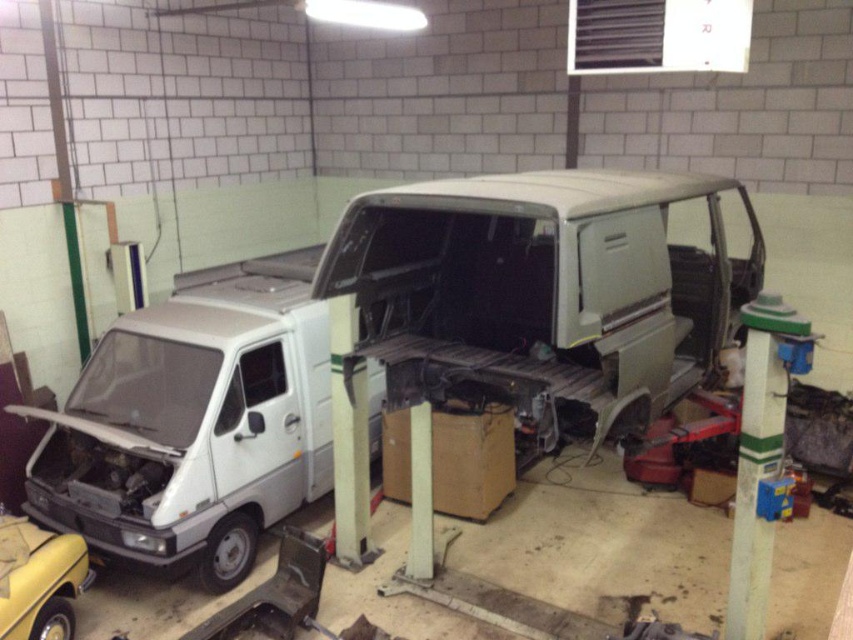
Does white matte van at left appear under yellow matte car at lower left?

No.

Based on the photo, between white matte van at left and yellow matte car at lower left, which one has less height?

yellow matte car at lower left is shorter.

Identify the location of white matte van at left. This screenshot has width=853, height=640. (194, 420).